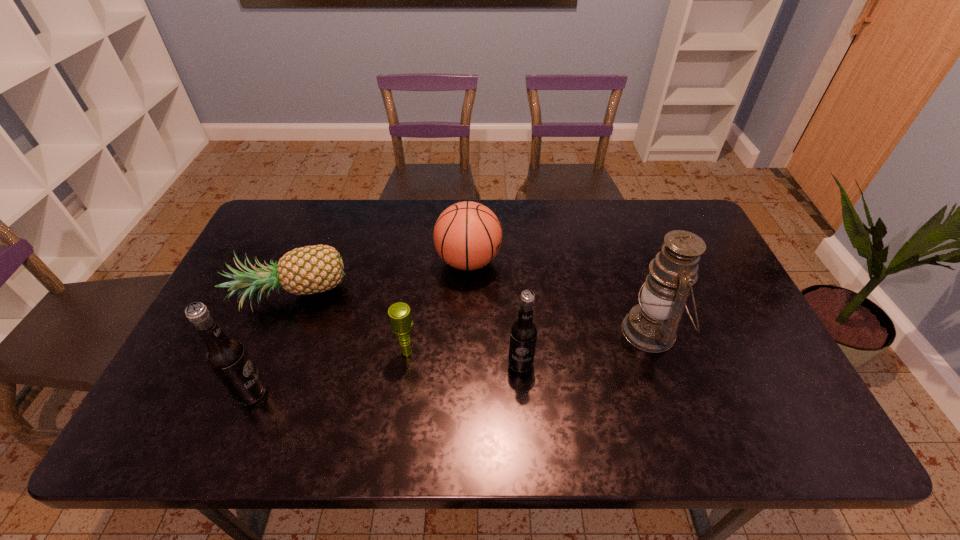
What are the coordinates of `vacant space positioned on the surface of the third shortest object near the brand logo` in the screenshot? It's located at (547, 261).

This screenshot has width=960, height=540. What are the coordinates of `free space located 0.050m on the right of the rightmost object` in the screenshot? It's located at (699, 332).

You are a GUI agent. You are given a task and a screenshot of the screen. Output one action in this format:
    pyautogui.click(x=<x>, y=<y>)
    Task: Click on the vacant space located on the right of the fourth object from right to left
    Image resolution: width=960 pixels, height=540 pixels.
    Given the screenshot: What is the action you would take?
    pyautogui.click(x=572, y=352)

You are a GUI agent. You are given a task and a screenshot of the screen. Output one action in this format:
    pyautogui.click(x=<x>, y=<y>)
    Task: Click on the free point located 0.130m on the right of the pineapple
    Image resolution: width=960 pixels, height=540 pixels.
    Given the screenshot: What is the action you would take?
    pyautogui.click(x=395, y=298)

Locate an element on the screen. object located at the far edge is located at coordinates point(467,235).

Find the location of a particular element. Image resolution: width=960 pixels, height=540 pixels. root beer positioned at the left edge is located at coordinates (226, 357).

What are the coordinates of `pineapple that is at the left edge` in the screenshot? It's located at (311, 269).

Find the location of a particular element. This screenshot has height=540, width=960. object situated at the near left corner is located at coordinates (226, 357).

Image resolution: width=960 pixels, height=540 pixels. Find the location of `vacant space at the far edge of the desktop`. vacant space at the far edge of the desktop is located at coordinates 613,207.

This screenshot has height=540, width=960. What are the coordinates of `free space at the near edge of the desktop` in the screenshot? It's located at (689, 395).